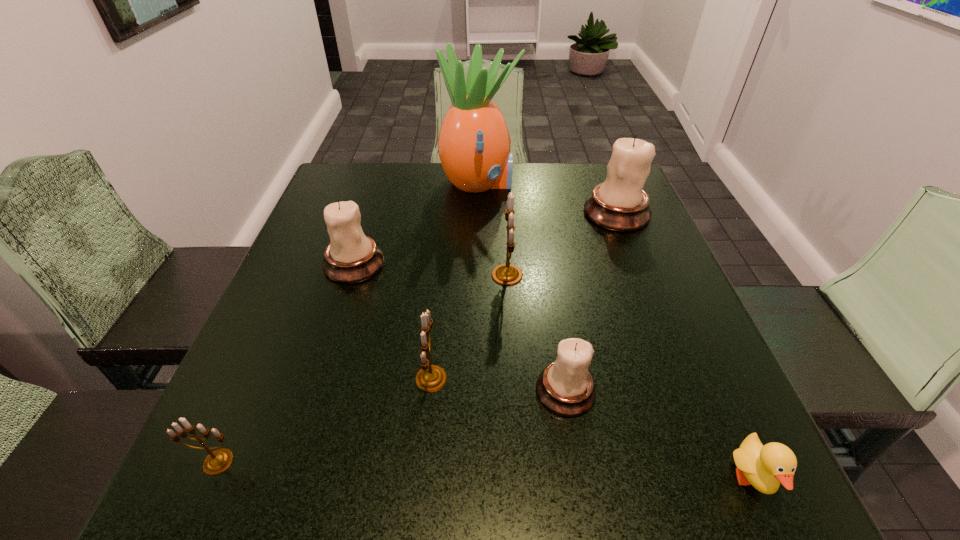
I want to click on free spot between the second biggest gold candelabrum and the smallest gold candelabrum, so click(x=324, y=420).

The width and height of the screenshot is (960, 540). I want to click on vacant region between the rightmost candelabrum and the second gold candelabrum from right to left, so click(524, 296).

Image resolution: width=960 pixels, height=540 pixels. I want to click on free space between the third candelabrum from left to right and the farthest candelabrum, so click(x=524, y=296).

You are a GUI agent. You are given a task and a screenshot of the screen. Output one action in this format:
    pyautogui.click(x=<x>, y=<y>)
    Task: Click on the vacant point located between the rightmost white candle holder and the third candelabrum from right to left
    The image size is (960, 540).
    Given the screenshot: What is the action you would take?
    pyautogui.click(x=562, y=244)

Locate an element on the screen. Image resolution: width=960 pixels, height=540 pixels. vacant area that lies between the pineapple and the yellow duckling is located at coordinates (615, 332).

Locate an element on the screen. unoccupied position between the pineapple and the nearest gold candelabrum is located at coordinates 348,322.

The image size is (960, 540). I want to click on vacant area that lies between the leftmost white candle holder and the farthest white candle holder, so click(x=485, y=239).

Where is `free space between the pineapple and the third candelabrum from right to left`? The height and width of the screenshot is (540, 960). free space between the pineapple and the third candelabrum from right to left is located at coordinates coord(492,229).

Locate an element on the screen. free spot between the rightmost gold candelabrum and the duckling is located at coordinates (630, 377).

Identify which object is the fourth closest to the second biggest gold candelabrum. Please provide its 2D coordinates. Your answer should be formatted as a tuple, i.e. [(x, y)], where the tuple contains the x and y coordinates of a point satisfying the conditions above.

[(218, 461)]